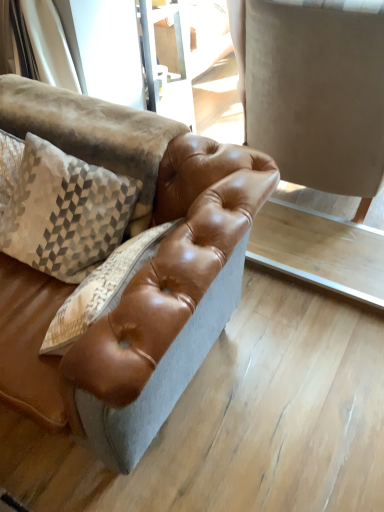
Where is `light brown leather table at center`? light brown leather table at center is located at coordinates (320, 250).

What do you see at coordinates (60, 208) in the screenshot?
I see `textured beige pillow at upper left` at bounding box center [60, 208].

This screenshot has height=512, width=384. What are the coordinates of `light brown leather table at center` in the screenshot? It's located at (320, 250).

Is point (370, 149) farther from camera compared to point (328, 288)?

No, (370, 149) is closer to viewer.

Are brown leather swivel chair at center and light brown leather table at center making contact?

No, brown leather swivel chair at center is not beside light brown leather table at center.

Is brown leather swivel chair at center to the right of light brown leather table at center from the viewer's perspective?

Indeed, brown leather swivel chair at center is positioned on the right side of light brown leather table at center.

How different are the orientations of brown leather swivel chair at center and light brown leather table at center in degrees?

179 degrees.

Based on the photo, from the image's perspective, which is above, light brown leather table at center or textured beige pillow at upper left?

textured beige pillow at upper left is shown above in the image.

Looking at this image, between light brown leather table at center and textured beige pillow at upper left, which one has larger size?

Bigger between the two is textured beige pillow at upper left.

Does point (365, 288) lie behind point (73, 183)?

Yes, point (365, 288) is farther from viewer.

Does light brown leather table at center have a greater height compared to textured beige pillow at upper left?

No.

Is point (87, 249) less distant than point (380, 93)?

Yes, it is.

Find the location of a particular element. pillow above the brown leather swivel chair at center (from a real-world perspective) is located at coordinates (60, 208).

Is textured beige pillow at upper left touching brown leather swivel chair at center?

textured beige pillow at upper left and brown leather swivel chair at center are clearly separated.

Is light brown leather table at center at the back of textured beige pillow at upper left?

No.

From the picture: Can you confirm if textured beige pillow at upper left is smaller than light brown leather table at center?

Actually, textured beige pillow at upper left might be larger than light brown leather table at center.

Which object is positioned more to the left, textured beige pillow at upper left or light brown leather table at center?

Positioned to the left is textured beige pillow at upper left.

Considering the sizes of objects textured beige pillow at upper left and light brown leather table at center in the image provided, who is wider, textured beige pillow at upper left or light brown leather table at center?

light brown leather table at center.

Is brown leather swivel chair at center taller or shorter than textured beige pillow at upper left?

brown leather swivel chair at center is taller than textured beige pillow at upper left.

Which is in front, brown leather swivel chair at center or textured beige pillow at upper left?

textured beige pillow at upper left is more forward.

Does brown leather swivel chair at center appear on the right side of textured beige pillow at upper left?

Yes, brown leather swivel chair at center is to the right of textured beige pillow at upper left.

Which of these two, brown leather swivel chair at center or textured beige pillow at upper left, is thinner?

With smaller width is textured beige pillow at upper left.

Consider the image. Is light brown leather table at center situated inside brown leather swivel chair at center or outside?

light brown leather table at center lies outside brown leather swivel chair at center.

Can you confirm if light brown leather table at center is shorter than brown leather swivel chair at center?

Yes.

Looking at this image, does light brown leather table at center have a smaller size compared to brown leather swivel chair at center?

Correct, light brown leather table at center occupies less space than brown leather swivel chair at center.

This screenshot has height=512, width=384. What are the coordinates of `swivel chair in front of the light brown leather table at center` in the screenshot? It's located at (316, 95).

At what (x,y) coordinates should I click in order to perform the action: click on pillow on the left of light brown leather table at center. Please return your answer as a coordinate pair (x, y). Image resolution: width=384 pixels, height=512 pixels. Looking at the image, I should click on (60, 208).

Looking at the image, which one is located further to textured beige pillow at upper left, light brown leather table at center or brown leather swivel chair at center?

brown leather swivel chair at center is positioned further to the anchor textured beige pillow at upper left.

When comparing their distances from light brown leather table at center, does brown leather swivel chair at center or textured beige pillow at upper left seem closer?

The object closer to light brown leather table at center is brown leather swivel chair at center.

From the image, which object appears to be nearer to light brown leather table at center, textured beige pillow at upper left or brown leather swivel chair at center?

brown leather swivel chair at center lies closer to light brown leather table at center than the other object.

Estimate the real-world distances between objects in this image. Which object is further from brown leather swivel chair at center, textured beige pillow at upper left or light brown leather table at center?

textured beige pillow at upper left is further to brown leather swivel chair at center.

Which object lies further to the anchor point textured beige pillow at upper left, brown leather swivel chair at center or light brown leather table at center?

The object further to textured beige pillow at upper left is brown leather swivel chair at center.

Estimate the real-world distances between objects in this image. Which object is closer to brown leather swivel chair at center, light brown leather table at center or textured beige pillow at upper left?

light brown leather table at center.

Where is `table located between textured beige pillow at upper left and brown leather swivel chair at center in the left-right direction`? The height and width of the screenshot is (512, 384). table located between textured beige pillow at upper left and brown leather swivel chair at center in the left-right direction is located at coordinates (320, 250).